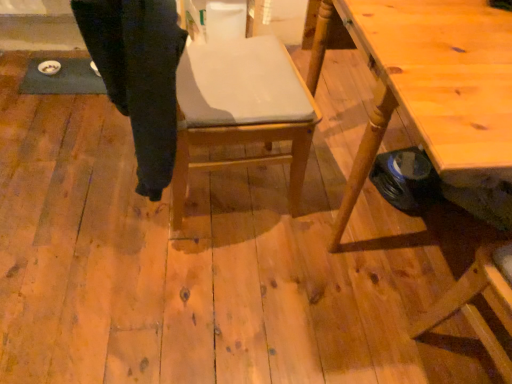
Question: From the image's perspective, does wooden chair at center appear higher than black cotton trousers at center?

Choices:
 (A) yes
 (B) no

Answer: (B)

Question: From a real-world perspective, is wooden chair at center on top of black cotton trousers at center?

Choices:
 (A) no
 (B) yes

Answer: (A)

Question: Considering the relative positions of wooden chair at center and black cotton trousers at center in the image provided, is wooden chair at center to the left of black cotton trousers at center from the viewer's perspective?

Choices:
 (A) no
 (B) yes

Answer: (A)

Question: Would you say wooden chair at center is outside black cotton trousers at center?

Choices:
 (A) yes
 (B) no

Answer: (A)

Question: From the image's perspective, is wooden chair at center located beneath black cotton trousers at center?

Choices:
 (A) no
 (B) yes

Answer: (B)

Question: Can you confirm if wooden chair at center is shorter than black cotton trousers at center?

Choices:
 (A) no
 (B) yes

Answer: (A)

Question: Can you confirm if wooden table at right is smaller than black cotton trousers at center?

Choices:
 (A) no
 (B) yes

Answer: (A)

Question: From the image's perspective, would you say wooden table at right is shown under black cotton trousers at center?

Choices:
 (A) no
 (B) yes

Answer: (B)

Question: Is wooden table at right positioned far away from black cotton trousers at center?

Choices:
 (A) yes
 (B) no

Answer: (B)

Question: From the image's perspective, is wooden table at right above black cotton trousers at center?

Choices:
 (A) yes
 (B) no

Answer: (B)

Question: Is wooden table at right bigger than black cotton trousers at center?

Choices:
 (A) no
 (B) yes

Answer: (B)

Question: Could you tell me if wooden table at right is turned towards black cotton trousers at center?

Choices:
 (A) no
 (B) yes

Answer: (B)

Question: Is wooden chair at center not inside wooden table at right?

Choices:
 (A) yes
 (B) no

Answer: (A)